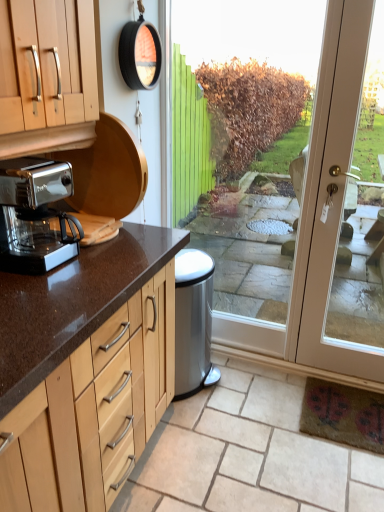
Question: From the image's perspective, is metallic glass coffee maker at left beneath transparent glass door at center?

Choices:
 (A) yes
 (B) no

Answer: (A)

Question: Does metallic glass coffee maker at left have a greater height compared to transparent glass door at center?

Choices:
 (A) no
 (B) yes

Answer: (A)

Question: From a real-world perspective, is metallic glass coffee maker at left beneath transparent glass door at center?

Choices:
 (A) yes
 (B) no

Answer: (B)

Question: Is metallic glass coffee maker at left placed right next to transparent glass door at center?

Choices:
 (A) no
 (B) yes

Answer: (A)

Question: Does metallic glass coffee maker at left lie behind transparent glass door at center?

Choices:
 (A) no
 (B) yes

Answer: (A)

Question: From the image's perspective, is metallic glass coffee maker at left over transparent glass door at center?

Choices:
 (A) yes
 (B) no

Answer: (B)

Question: Considering the relative sizes of light brown wood at lower left and transparent glass door at center in the image provided, is light brown wood at lower left thinner than transparent glass door at center?

Choices:
 (A) no
 (B) yes

Answer: (A)

Question: Is light brown wood at lower left at the right side of transparent glass door at center?

Choices:
 (A) no
 (B) yes

Answer: (A)

Question: Is light brown wood at lower left further to camera compared to transparent glass door at center?

Choices:
 (A) yes
 (B) no

Answer: (B)

Question: Considering the relative sizes of light brown wood at lower left and transparent glass door at center in the image provided, is light brown wood at lower left bigger than transparent glass door at center?

Choices:
 (A) no
 (B) yes

Answer: (A)

Question: Is light brown wood at lower left at the left side of transparent glass door at center?

Choices:
 (A) yes
 (B) no

Answer: (A)

Question: Is light brown wood at lower left taller than transparent glass door at center?

Choices:
 (A) no
 (B) yes

Answer: (A)

Question: Considering the relative positions of light brown wood at lower left and metallic glass coffee maker at left in the image provided, is light brown wood at lower left behind metallic glass coffee maker at left?

Choices:
 (A) yes
 (B) no

Answer: (A)